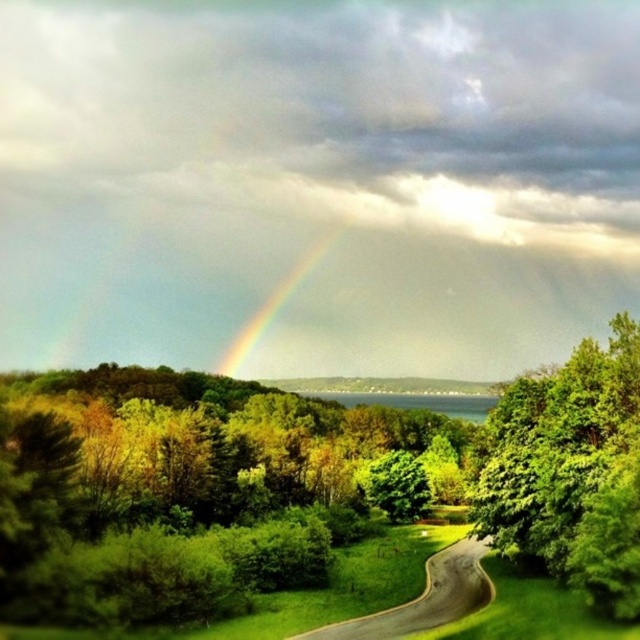
You are standing at the point marked as point (424, 596) in the image. What is the color of the surface you are currently standing on?

The surface at point (424, 596) is green asphalt road at center.

You are standing in the forest below the rainbow and want to take a photo of the point at coordinates point [396,627]. Your camera has a maximum focus range of 70 meters. Will the point be in focus?

The distance of point [396,627] from the camera is 69.70 meters, which is within the camera maximum focus range of 70 meters. The point will be in focus.